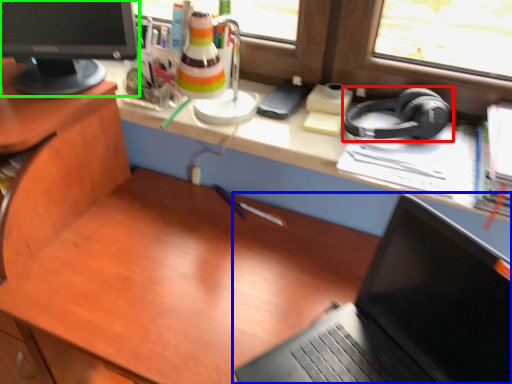
Question: Estimate the real-world distances between objects in this image. Which object is farther from headphones (highlighted by a red box), laptop (highlighted by a blue box) or computer monitor (highlighted by a green box)?

Choices:
 (A) laptop
 (B) computer monitor

Answer: (B)